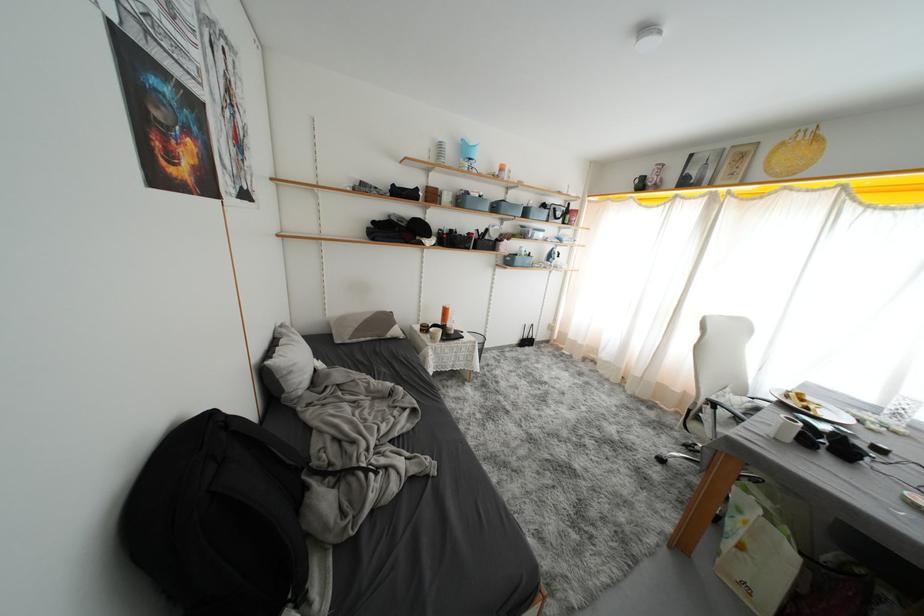
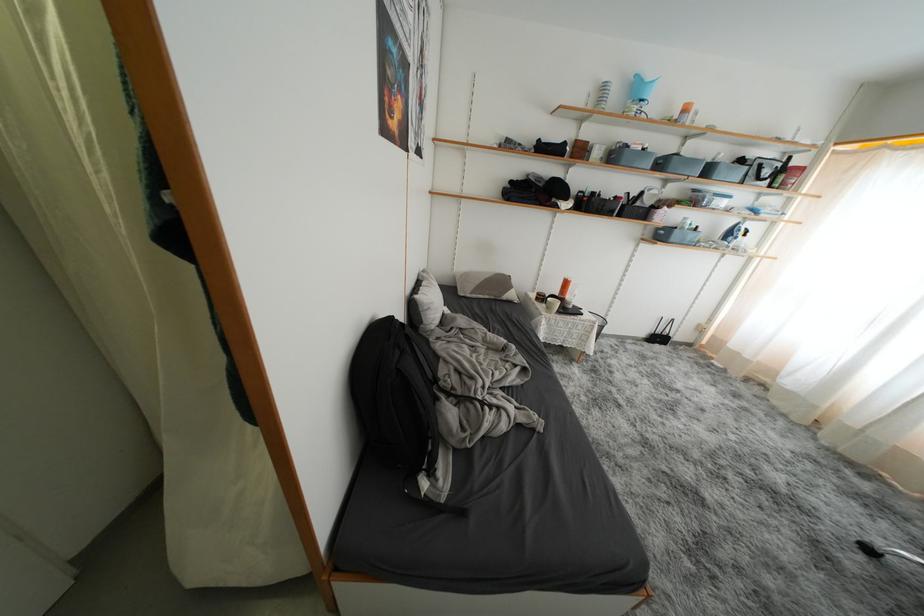
Locate, in the second image, the point that corresponds to the point at 502,212 in the first image.

(667, 168)